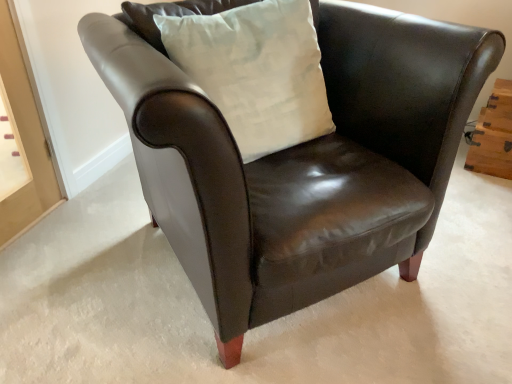
Question: From a real-world perspective, relative to white cotton pillow at upper center, is wooden drawer at right vertically above or below?

Choices:
 (A) above
 (B) below

Answer: (B)

Question: Considering the positions of wooden drawer at right and white cotton pillow at upper center in the image, is wooden drawer at right wider or thinner than white cotton pillow at upper center?

Choices:
 (A) thin
 (B) wide

Answer: (A)

Question: Is wooden drawer at right inside or outside of white cotton pillow at upper center?

Choices:
 (A) outside
 (B) inside

Answer: (A)

Question: Is white cotton pillow at upper center taller or shorter than wooden drawer at right?

Choices:
 (A) short
 (B) tall

Answer: (B)

Question: Is point (238, 23) positioned closer to the camera than point (501, 155)?

Choices:
 (A) closer
 (B) farther

Answer: (A)

Question: Which is correct: white cotton pillow at upper center is inside wooden drawer at right, or outside of it?

Choices:
 (A) outside
 (B) inside

Answer: (A)

Question: From the image's perspective, relative to wooden drawer at right, is white cotton pillow at upper center above or below?

Choices:
 (A) below
 (B) above

Answer: (B)